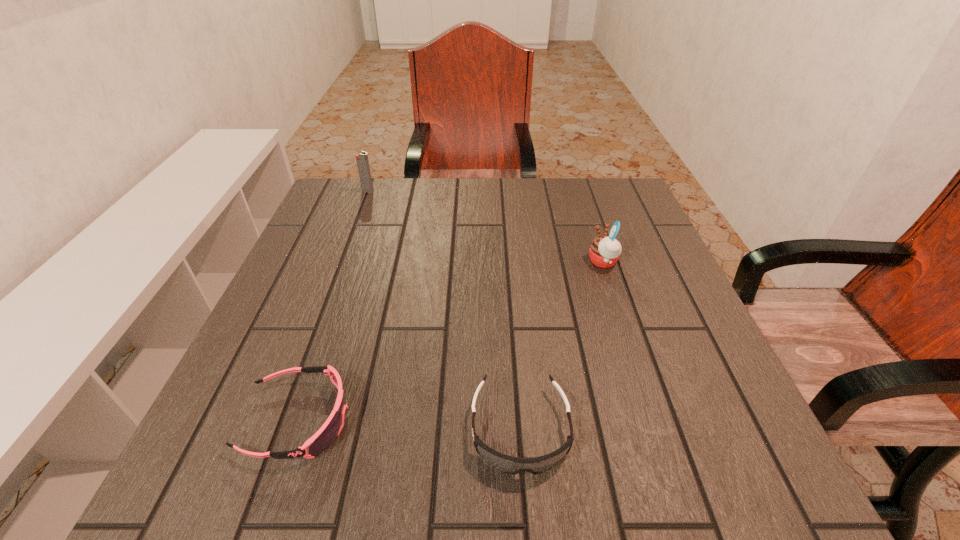
Identify which object is located as the third nearest to the right goggles. Please provide its 2D coordinates. Your answer should be formatted as a tuple, i.e. [(x, y)], where the tuple contains the x and y coordinates of a point satisfying the conditions above.

[(362, 161)]

Where is `the second closest object to the muffin`? This screenshot has height=540, width=960. the second closest object to the muffin is located at coordinates (323, 438).

Where is `free space that satisfies the following two spatial constraints: 1. on the front-facing side of the third nearest object; 2. on the front and sides of the third object from left to right`? free space that satisfies the following two spatial constraints: 1. on the front-facing side of the third nearest object; 2. on the front and sides of the third object from left to right is located at coordinates point(660,430).

Image resolution: width=960 pixels, height=540 pixels. Find the location of `free spot that satisfies the following two spatial constraints: 1. on the front-facing side of the third nearest object; 2. on the front and sides of the right goggles`. free spot that satisfies the following two spatial constraints: 1. on the front-facing side of the third nearest object; 2. on the front and sides of the right goggles is located at coordinates (660, 430).